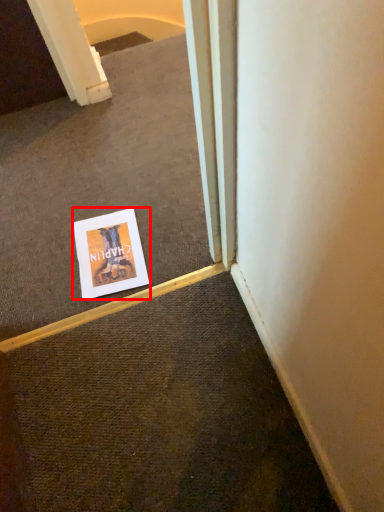
Question: From the image's perspective, where is poster (annotated by the red box) located relative to escalator?

Choices:
 (A) above
 (B) below

Answer: (B)